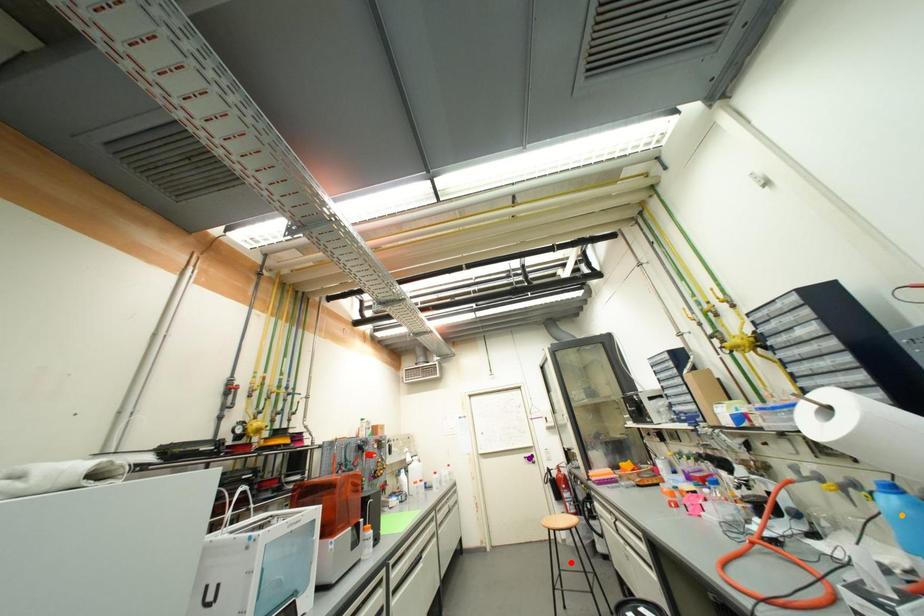
Order these from nearest to farthest:
1. orange point
2. red point
3. purple point

orange point < red point < purple point